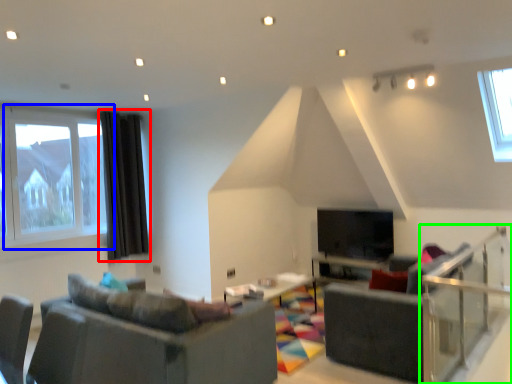
Question: Estimate the real-world distances between objects in this image. Which object is closer to curtain (highlighted by a red box), window (highlighted by a blue box) or balustrade (highlighted by a green box)?

Choices:
 (A) window
 (B) balustrade

Answer: (A)